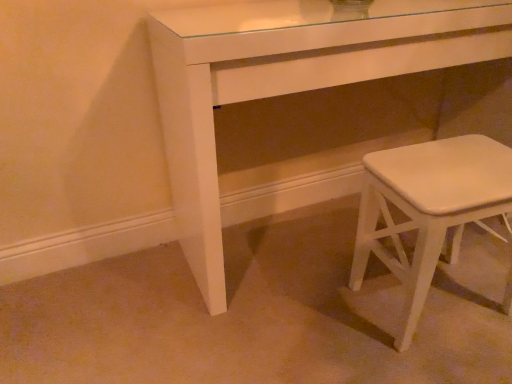
Locate an element on the screen. The height and width of the screenshot is (384, 512). white matte stool at lower right is located at coordinates (428, 207).

The height and width of the screenshot is (384, 512). What do you see at coordinates (428, 207) in the screenshot?
I see `white matte stool at lower right` at bounding box center [428, 207].

Measure the distance between white glossy table at center and camera.

white glossy table at center is 34.49 inches from camera.

Describe the element at coordinates (288, 80) in the screenshot. I see `white glossy table at center` at that location.

What are the coordinates of `white glossy table at center` in the screenshot? It's located at (288, 80).

Where is `white matte stool at lower right`? white matte stool at lower right is located at coordinates (428, 207).

Can you confirm if white matte stool at lower right is positioned to the right of white glossy table at center?

Yes, white matte stool at lower right is to the right of white glossy table at center.

Is white matte stool at lower right positioned behind white glossy table at center?

That is True.

Does point (377, 207) come farther from viewer compared to point (288, 18)?

No.

From the image's perspective, which is below, white matte stool at lower right or white glossy table at center?

From the image's view, white matte stool at lower right is below.

From a real-world perspective, is white matte stool at lower right under white glossy table at center?

Yes, from a real-world perspective, white matte stool at lower right is beneath white glossy table at center.

In terms of width, does white matte stool at lower right look wider or thinner when compared to white glossy table at center?

white matte stool at lower right is thinner than white glossy table at center.

Is white matte stool at lower right shorter than white glossy table at center?

Correct, white matte stool at lower right is not as tall as white glossy table at center.

Between white matte stool at lower right and white glossy table at center, which one has smaller size?

With smaller size is white matte stool at lower right.

Is white matte stool at lower right not within white glossy table at center?

white matte stool at lower right lies outside white glossy table at center's area.

Is white matte stool at lower right next to white glossy table at center?

white matte stool at lower right and white glossy table at center are not in contact.

Is white matte stool at lower right oriented away from white glossy table at center?

Absolutely, white matte stool at lower right is directed away from white glossy table at center.

Identify the location of stool below the white glossy table at center (from a real-world perspective). This screenshot has height=384, width=512. (428, 207).

Which object is positioned more to the right, white glossy table at center or white matte stool at lower right?

Positioned to the right is white matte stool at lower right.

Which is behind, white glossy table at center or white matte stool at lower right?

white matte stool at lower right is more distant.

Does point (394, 50) come behind point (418, 284)?

That is True.

From the image's perspective, between white glossy table at center and white matte stool at lower right, who is located below?

white matte stool at lower right is shown below in the image.

From a real-world perspective, which is physically above, white glossy table at center or white matte stool at lower right?

From a 3D spatial view, white glossy table at center is above.

Which of these two, white glossy table at center or white matte stool at lower right, is wider?

white glossy table at center is wider.

In terms of height, does white glossy table at center look taller or shorter compared to white matte stool at lower right?

Clearly, white glossy table at center is taller compared to white matte stool at lower right.

Looking at the image, does white glossy table at center seem bigger or smaller compared to white matte stool at lower right?

In the image, white glossy table at center appears to be larger than white matte stool at lower right.

Choose the correct answer: Is white glossy table at center inside white matte stool at lower right or outside it?

white glossy table at center is not enclosed by white matte stool at lower right.

Are white glossy table at center and white matte stool at lower right far apart?

That's not correct — white glossy table at center is a little close to white matte stool at lower right.

Is white glossy table at center facing away from white matte stool at lower right?

Yes, white glossy table at center is positioned with its back facing white matte stool at lower right.

At what (x,y) coordinates should I click in order to perform the action: click on table to the left of white matte stool at lower right. Please return your answer as a coordinate pair (x, y). The image size is (512, 384). Looking at the image, I should click on (288, 80).

Locate an element on the screen. This screenshot has width=512, height=384. table that appears above the white matte stool at lower right (from a real-world perspective) is located at coordinates (288, 80).

Where is `table that appears above the white matte stool at lower right (from the image's perspective)`? Image resolution: width=512 pixels, height=384 pixels. table that appears above the white matte stool at lower right (from the image's perspective) is located at coordinates (288, 80).